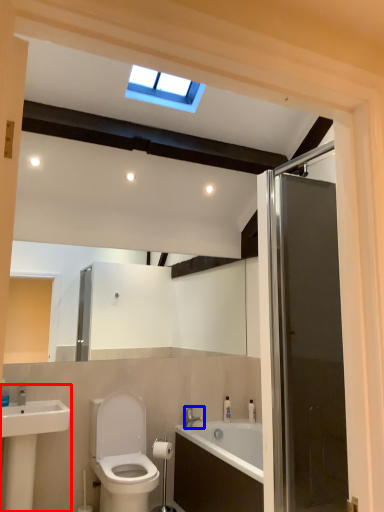
Question: Which of the following is the farthest to the observer, sink (highlighted by a red box) or tap (highlighted by a blue box)?

Choices:
 (A) sink
 (B) tap

Answer: (B)